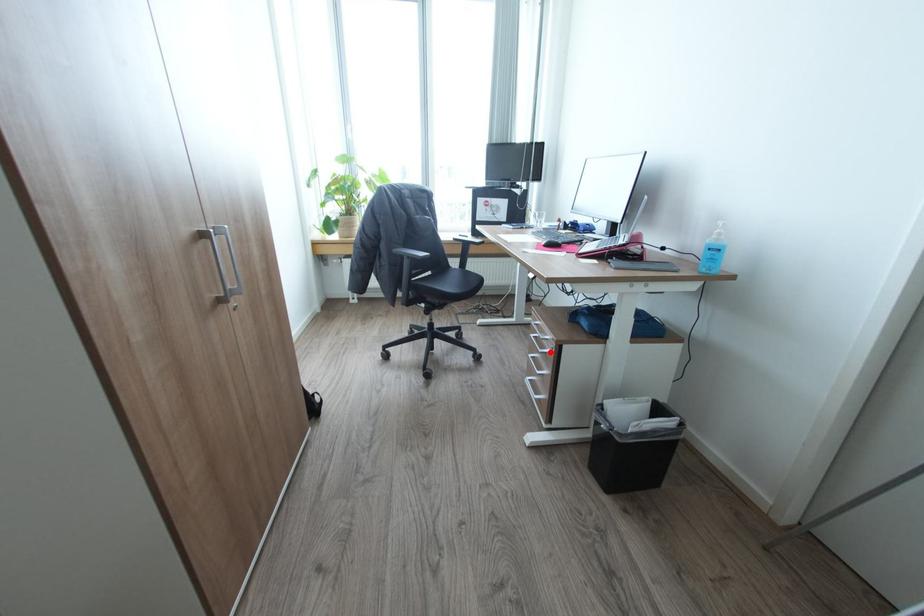
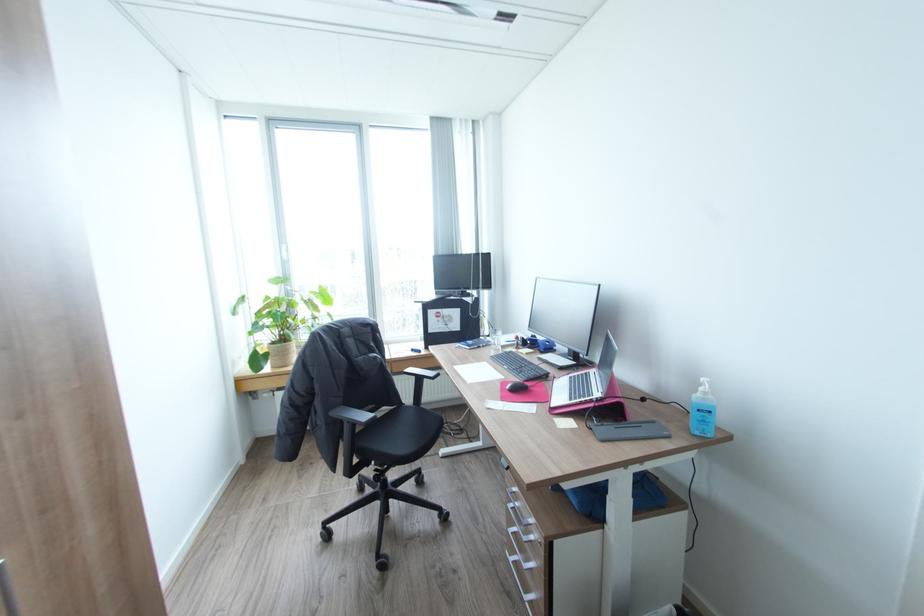
In the second image, find the point that corresponds to the highlighted location in the first image.

(536, 541)